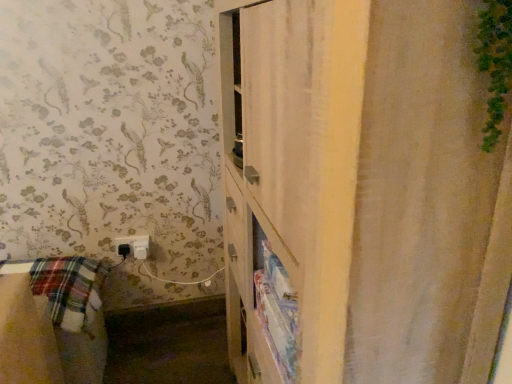
The height and width of the screenshot is (384, 512). What do you see at coordinates (133, 246) in the screenshot?
I see `white plastic electric outlet at lower left` at bounding box center [133, 246].

Locate an element on the screen. Image resolution: width=512 pixels, height=384 pixels. white plastic electric outlet at lower left is located at coordinates (133, 246).

This screenshot has width=512, height=384. What are the coordinates of `white textured shower curtain at right` in the screenshot? It's located at (428, 203).

What do you see at coordinates (428, 203) in the screenshot? The width and height of the screenshot is (512, 384). I see `white textured shower curtain at right` at bounding box center [428, 203].

You are a GUI agent. You are given a task and a screenshot of the screen. Output one action in this format:
    pyautogui.click(x=<x>, y=<y>)
    Task: Click on the white plastic electric outlet at lower left
    This screenshot has width=512, height=384.
    Given the screenshot: What is the action you would take?
    pyautogui.click(x=133, y=246)

Considering the relative positions of white plastic electric outlet at lower left and white textured shower curtain at right in the image provided, is white plastic electric outlet at lower left to the left or to the right of white textured shower curtain at right?

Based on their positions, white plastic electric outlet at lower left is located to the left of white textured shower curtain at right.

In the image, is white plastic electric outlet at lower left positioned in front of or behind white textured shower curtain at right?

Visually, white plastic electric outlet at lower left is located behind white textured shower curtain at right.

Which is in front, point (147, 251) or point (383, 171)?

The point (383, 171) is closer.

From the picture: From the image's perspective, between white plastic electric outlet at lower left and white textured shower curtain at right, which one is located above?

white textured shower curtain at right.

From a real-world perspective, which is physically below, white plastic electric outlet at lower left or white textured shower curtain at right?

From a 3D spatial view, white plastic electric outlet at lower left is below.

Which object is thinner, white plastic electric outlet at lower left or white textured shower curtain at right?

With smaller width is white plastic electric outlet at lower left.

Is white plastic electric outlet at lower left shorter than white textured shower curtain at right?

Correct, white plastic electric outlet at lower left is not as tall as white textured shower curtain at right.

Can you confirm if white plastic electric outlet at lower left is smaller than white textured shower curtain at right?

Yes, white plastic electric outlet at lower left is smaller than white textured shower curtain at right.

Is white plastic electric outlet at lower left spatially inside white textured shower curtain at right, or outside of it?

white plastic electric outlet at lower left is not inside white textured shower curtain at right, it's outside.

Is white plastic electric outlet at lower left directly adjacent to white textured shower curtain at right?

white plastic electric outlet at lower left is not next to white textured shower curtain at right, and they're not touching.

Is white plastic electric outlet at lower left facing towards white textured shower curtain at right?

No.

How many degrees apart are the facing directions of white plastic electric outlet at lower left and white textured shower curtain at right?

The angular difference between white plastic electric outlet at lower left and white textured shower curtain at right is 90.2 degrees.

You are a GUI agent. You are given a task and a screenshot of the screen. Output one action in this format:
    pyautogui.click(x=<x>, y=<y>)
    Task: Click on the shower curtain lying above the white plastic electric outlet at lower left (from the image's perspective)
    This screenshot has height=384, width=512.
    Given the screenshot: What is the action you would take?
    pyautogui.click(x=428, y=203)

Between white textured shower curtain at right and white plastic electric outlet at lower left, which one appears on the left side from the viewer's perspective?

Positioned to the left is white plastic electric outlet at lower left.

Looking at this image, does white textured shower curtain at right lie behind white plastic electric outlet at lower left?

No.

Which is more distant, (368, 236) or (123, 243)?

The point (123, 243) is behind.

From the image's perspective, is white textured shower curtain at right on white plastic electric outlet at lower left?

Yes, from the image's perspective, white textured shower curtain at right is above white plastic electric outlet at lower left.

From the picture: From a real-world perspective, which object stands above the other?

In real-world perspective, white textured shower curtain at right is above.

Which of these two, white textured shower curtain at right or white plastic electric outlet at lower left, is thinner?

Thinner between the two is white plastic electric outlet at lower left.

Is white textured shower curtain at right taller or shorter than white plastic electric outlet at lower left?

white textured shower curtain at right is taller than white plastic electric outlet at lower left.

Considering the relative sizes of white textured shower curtain at right and white plastic electric outlet at lower left in the image provided, is white textured shower curtain at right bigger than white plastic electric outlet at lower left?

Correct, white textured shower curtain at right is larger in size than white plastic electric outlet at lower left.

Is white textured shower curtain at right not inside white plastic electric outlet at lower left?

Yes, white textured shower curtain at right is outside of white plastic electric outlet at lower left.

Is white textured shower curtain at right with white plastic electric outlet at lower left?

No, white textured shower curtain at right is not making contact with white plastic electric outlet at lower left.

Is white textured shower curtain at right facing away from white plastic electric outlet at lower left?

That's not correct — white textured shower curtain at right is not looking away from white plastic electric outlet at lower left.

Can you tell me how much white textured shower curtain at right and white plastic electric outlet at lower left differ in facing direction?

90.2 degrees separate the facing orientations of white textured shower curtain at right and white plastic electric outlet at lower left.

I want to click on shower curtain on the right of white plastic electric outlet at lower left, so [x=428, y=203].

Find the location of a particular element. This screenshot has width=512, height=384. shower curtain in front of the white plastic electric outlet at lower left is located at coordinates (428, 203).

Identify the location of electric outlet located underneath the white textured shower curtain at right (from a real-world perspective). (133, 246).